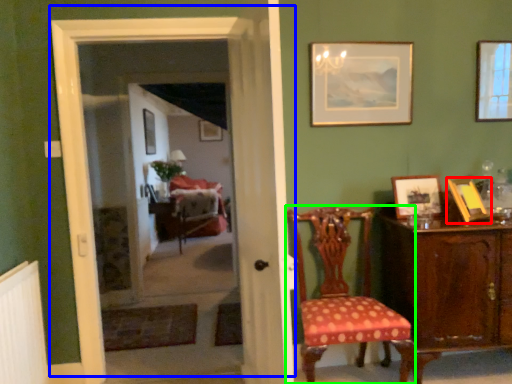
Question: Which object is positioned farthest from picture frame (highlighted by a red box)? Select from door (highlighted by a blue box) and chair (highlighted by a green box).

Choices:
 (A) door
 (B) chair

Answer: (A)